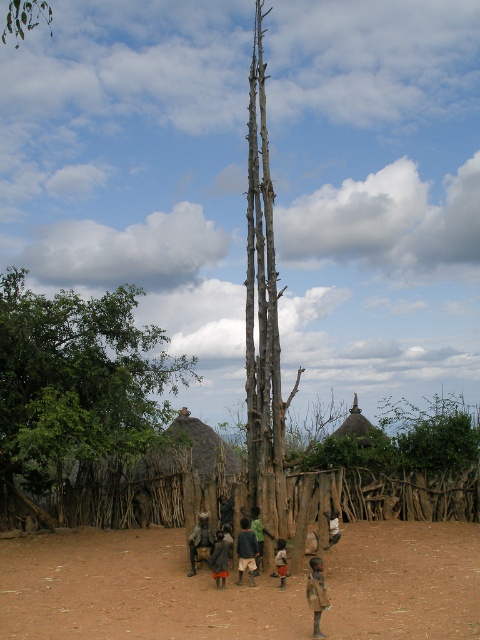
Can you confirm if brown dirt field at center is bigger than green leafy tree at left?

Actually, brown dirt field at center might be smaller than green leafy tree at left.

Between point (178, 612) and point (111, 380), which one is positioned in front?

Point (178, 612) is more forward.

Who is more forward, (x=405, y=554) or (x=19, y=356)?

Point (x=405, y=554)

Identify the location of brown dirt field at center. This screenshot has width=480, height=640. (134, 592).

Consider the image. Who is shorter, dark brown wooden person at center or brown fabric person at center?

brown fabric person at center

Is point (253, 545) more distant than point (336, 540)?

No, it is not.

What do you see at coordinates (245, 550) in the screenshot? This screenshot has width=480, height=640. I see `dark brown wooden person at center` at bounding box center [245, 550].

Find the location of a particular element. The height and width of the screenshot is (640, 480). dark brown wooden person at center is located at coordinates (245, 550).

Who is shorter, green leafy tree at left or brown fabric dress at center?

brown fabric dress at center

Between green leafy tree at left and brown fabric dress at center, which one has more height?

green leafy tree at left is taller.

Does point (96, 371) come in front of point (275, 557)?

No, (96, 371) is further to viewer.

Find the location of a particular element. green leafy tree at left is located at coordinates click(x=76, y=381).